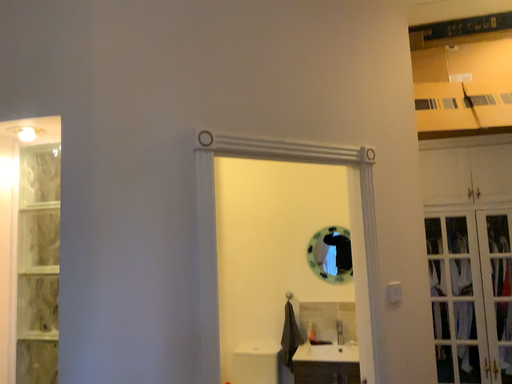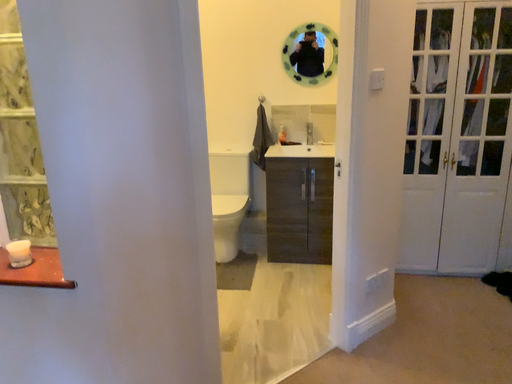
Question: Which way did the camera rotate in the video?

Choices:
 (A) rotated downward
 (B) rotated upward

Answer: (A)